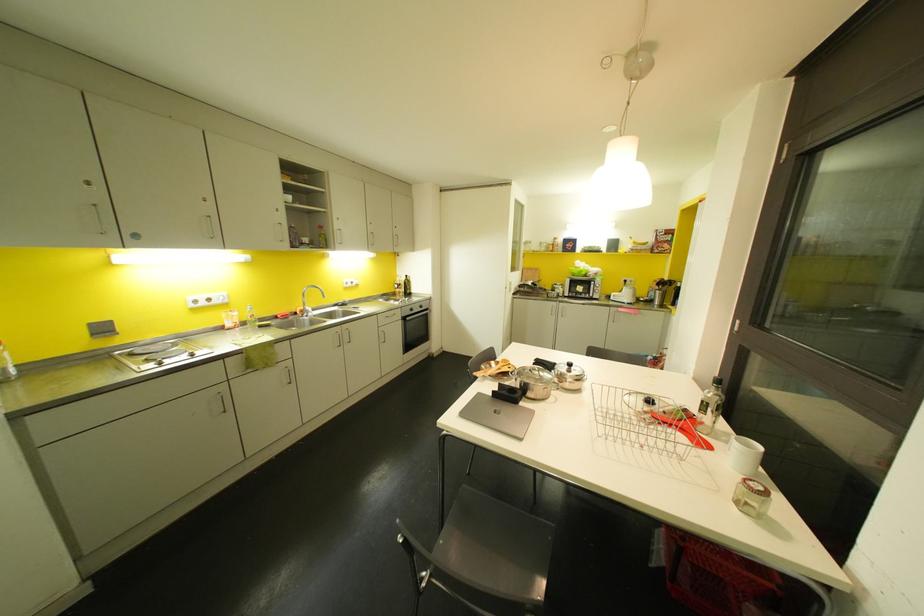
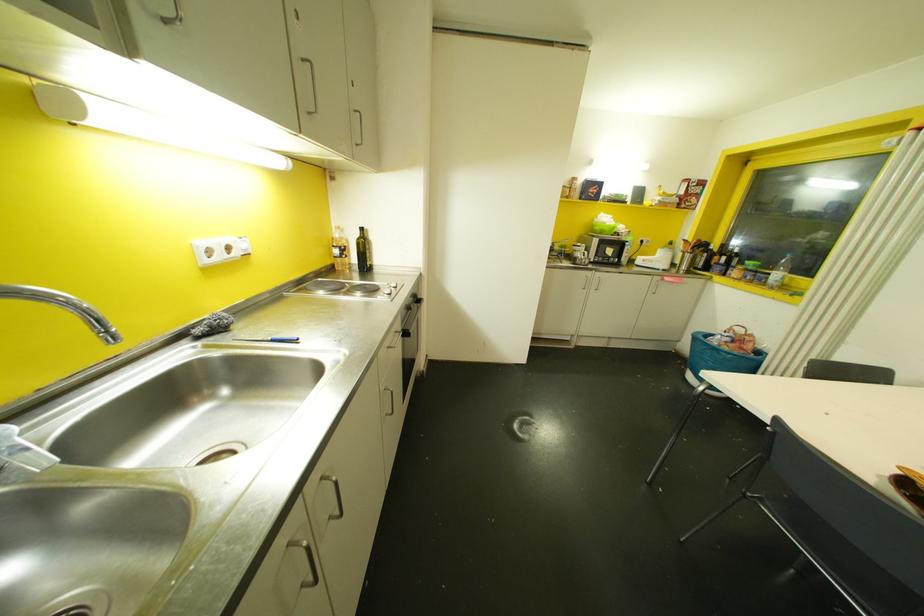
Locate, in the second image, the point that corresponds to point (395, 286) in the first image.

(335, 251)